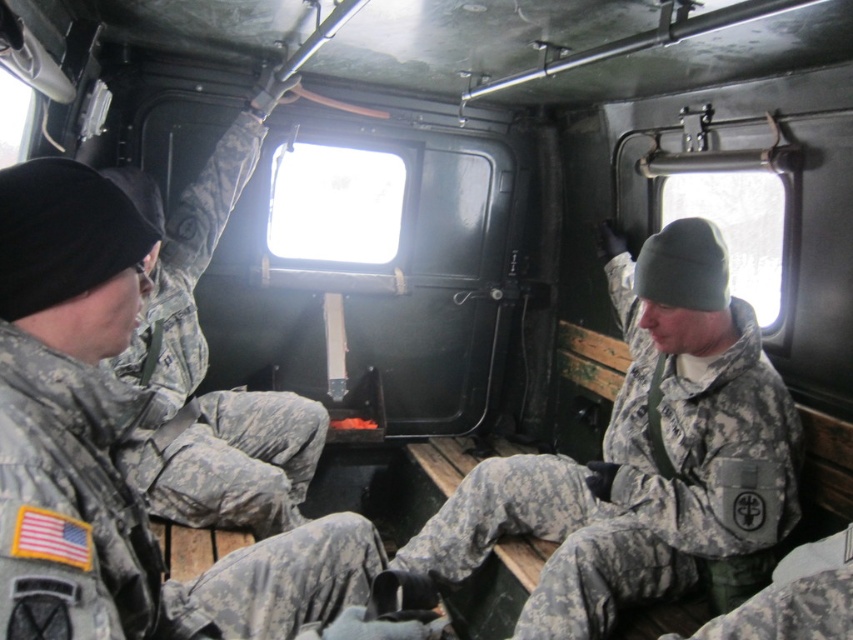
You are a soldier trying to pass through the narrow aisle between the camouflage fabric uniform at center and the camouflage fabric uniform at left. Can you fit through the aisle?

The camouflage fabric uniform at center might be wider than camouflage fabric uniform at left, so the aisle between them may not be wide enough for you to pass through safely.

You are a military medic who needs to reach the camouflage fabric uniform at center to check for injuries. You are currently standing next to the camouflage uniform at left. Given that your medical kit is 0.9 meters long, can you safely place it on the floor between them without it overlapping?

The distance between the camouflage fabric uniform at center and camouflage uniform at left is 1.11 meters. Since the medical kit is 0.9 meters long, there is enough space to place it between them without overlapping.